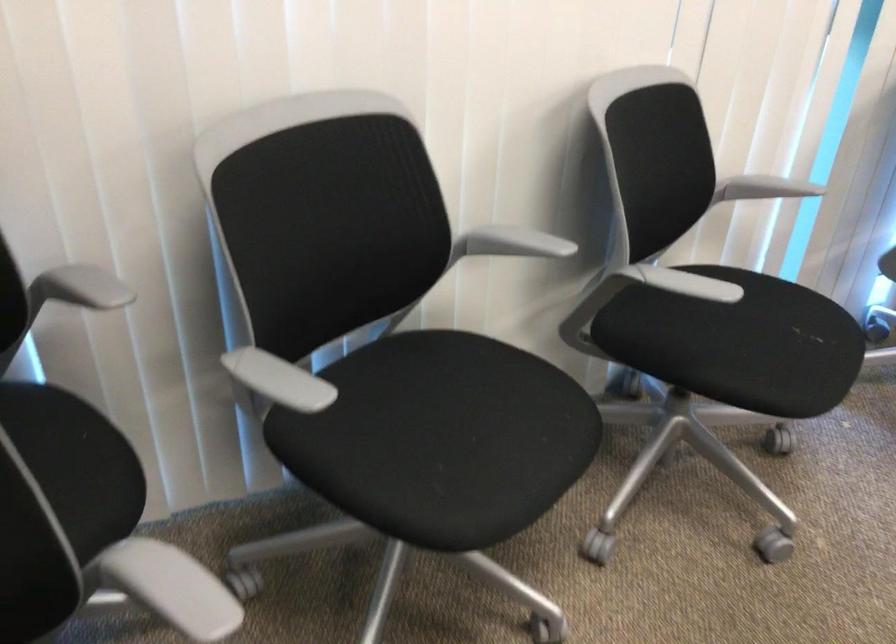
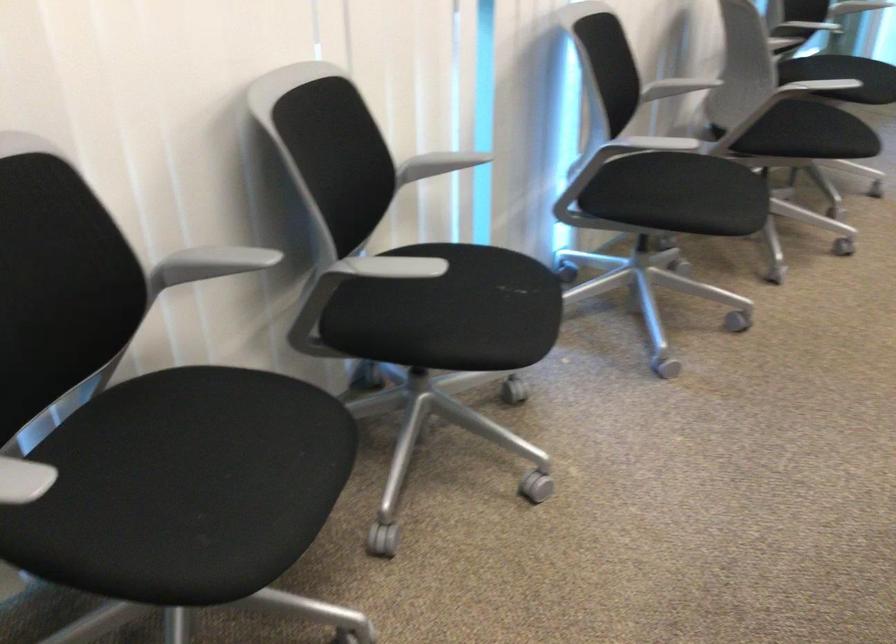
Where in the second image is the point corresponding to point 504,242 from the first image?

(211, 263)